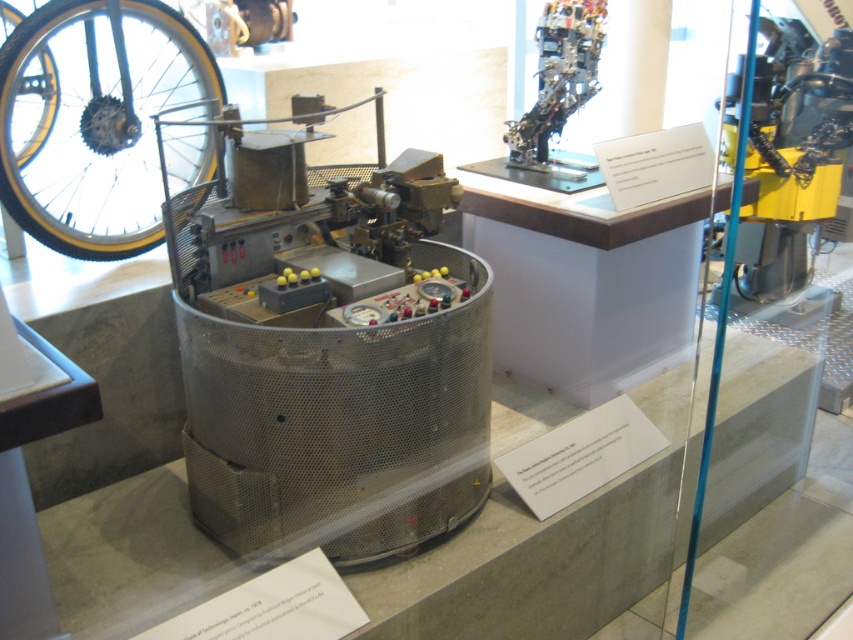
Question: Which point is farther to the camera?

Choices:
 (A) yellow rubber bicycle wheel at left
 (B) metallic mesh machine at center

Answer: (A)

Question: Does metallic mesh machine at center have a larger size compared to yellow rubber bicycle wheel at left?

Choices:
 (A) no
 (B) yes

Answer: (B)

Question: Which object is farther from the camera taking this photo?

Choices:
 (A) metallic mesh machine at center
 (B) yellow rubber bicycle wheel at left

Answer: (B)

Question: Can you confirm if metallic mesh machine at center is thinner than yellow rubber bicycle wheel at left?

Choices:
 (A) yes
 (B) no

Answer: (B)

Question: Can you confirm if metallic mesh machine at center is thinner than yellow rubber bicycle wheel at left?

Choices:
 (A) no
 (B) yes

Answer: (A)

Question: Which point appears closest to the camera in this image?

Choices:
 (A) pos(277,314)
 (B) pos(152,243)

Answer: (A)